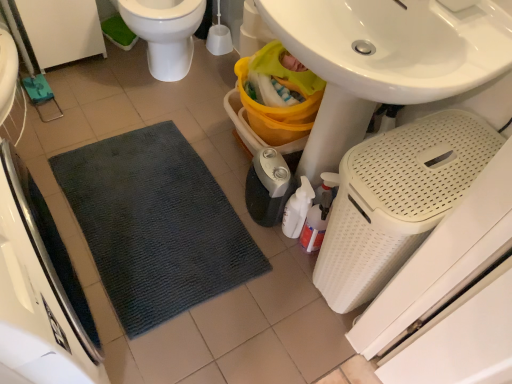
Question: Is translucent plastic spray bottle at lower center situated inside black plastic humidifier at lower center, the second appliance when ordered from left to right, or outside?

Choices:
 (A) outside
 (B) inside

Answer: (A)

Question: Considering the positions of translucent plastic spray bottle at lower center and black plastic humidifier at lower center, the 2th appliance from the right, in the image, is translucent plastic spray bottle at lower center wider or thinner than black plastic humidifier at lower center, the 2th appliance from the right,?

Choices:
 (A) thin
 (B) wide

Answer: (A)

Question: Considering the real-world distances, which object is farthest from the white perforated laundry basket at lower right, arranged as the 1th appliance when viewed from the right?

Choices:
 (A) white glossy toilet at upper left
 (B) black plastic humidifier at lower center, the 2th appliance from the right
 (C) translucent plastic spray bottle at lower center
 (D) dark gray textured mat at lower left, arranged as the 3th appliance when viewed from the right

Answer: (A)

Question: Which of these objects is positioned closest to the black plastic humidifier at lower center, the second appliance when ordered from left to right?

Choices:
 (A) white glossy toilet at upper left
 (B) dark gray textured mat at lower left, arranged as the 3th appliance when viewed from the right
 (C) translucent plastic spray bottle at lower center
 (D) white perforated laundry basket at lower right, arranged as the 1th appliance when viewed from the right

Answer: (C)